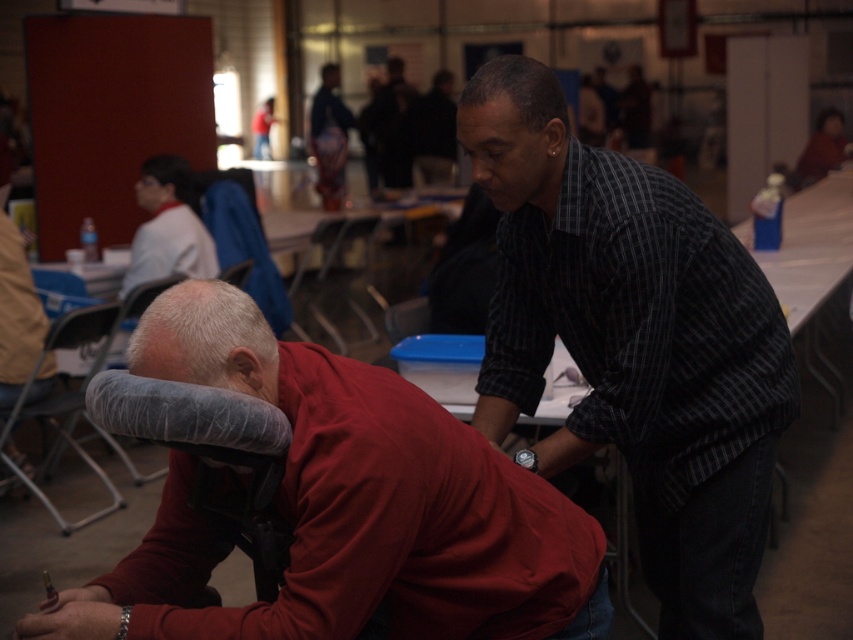
Which of these two, gray fabric headrest at lower center or light gray fabric chair at upper left, stands taller?

light gray fabric chair at upper left is taller.

Is gray fabric headrest at lower center below light gray fabric chair at upper left?

Correct, gray fabric headrest at lower center is located below light gray fabric chair at upper left.

The width and height of the screenshot is (853, 640). In order to click on gray fabric headrest at lower center in this screenshot , I will do [x=206, y=339].

Does gray fabric folding chair at lower left have a lesser width compared to metallic gray chair at center?

Indeed, gray fabric folding chair at lower left has a lesser width compared to metallic gray chair at center.

From the picture: Which is above, gray fabric folding chair at lower left or metallic gray chair at center?

metallic gray chair at center is above.

Measure the distance between gray fabric folding chair at lower left and camera.

A distance of 3.87 meters exists between gray fabric folding chair at lower left and camera.

In order to click on gray fabric folding chair at lower left in this screenshot , I will do `click(67, 400)`.

Is gray fabric headrest at lower center taller than gray fabric folding chair at lower left?

No, gray fabric headrest at lower center is not taller than gray fabric folding chair at lower left.

Can you confirm if gray fabric headrest at lower center is positioned to the left of gray fabric folding chair at lower left?

Incorrect, gray fabric headrest at lower center is not on the left side of gray fabric folding chair at lower left.

At what (x,y) coordinates should I click in order to perform the action: click on gray fabric headrest at lower center. Please return your answer as a coordinate pair (x, y). Looking at the image, I should click on (206, 339).